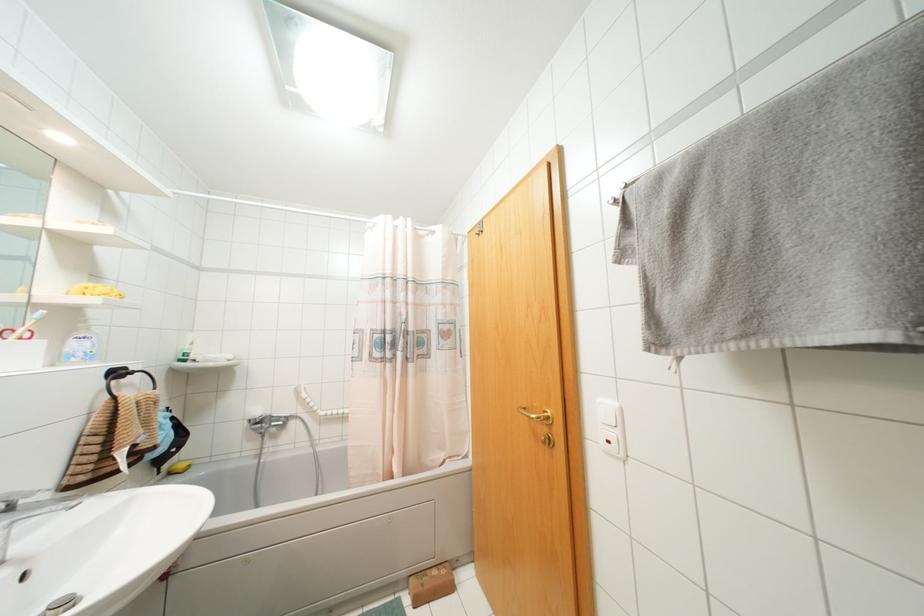
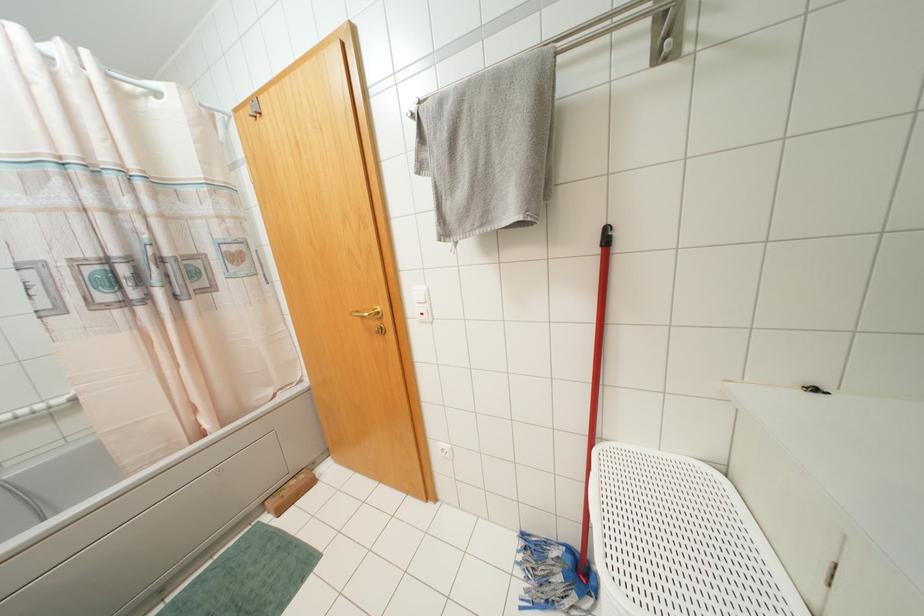
Question: I am providing you with two images of the same scene from different viewpoints. After the viewpoint changes to image2, which objects are now occluded?

Choices:
 (A) grey towel
 (B) red mop handle
 (C) white light switch
 (D) none of these

Answer: (D)